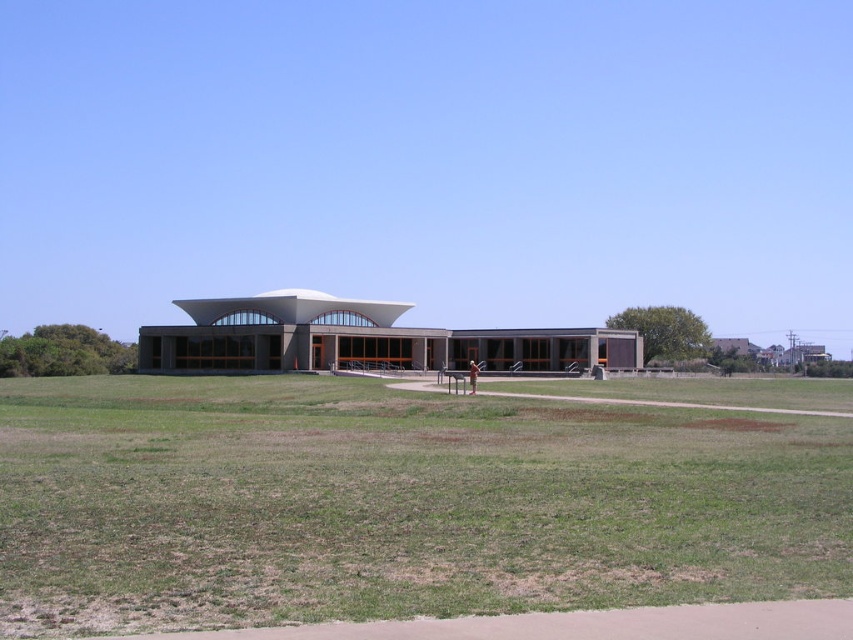
You are standing at the entrance of the modern building and want to reach the green grass at center. Which direction should you walk to get there?

The green grass at center is located at point coordinates, so you should walk towards the center of the image from the entrance to reach it.

You are a gardener planning to mow the lawn around the modern building. You have a lawn mower that can only handle areas smaller than the green grass at center. Based on the scene, will the brown textured shorts at center be manageable for your mower?

The green grass at center has a larger size compared to brown textured shorts at center. Since the lawn mower can handle areas smaller than the green grass at center, the brown textured shorts at center will be manageable for the mower because it is smaller in size.

You are standing at the entrance of the building and see the green grass at center and the brown textured shorts at center. Which object is located to the right when facing the building?

The green grass at center is to the right of the brown textured shorts at center, so the green grass at center is located to the right when facing the building.